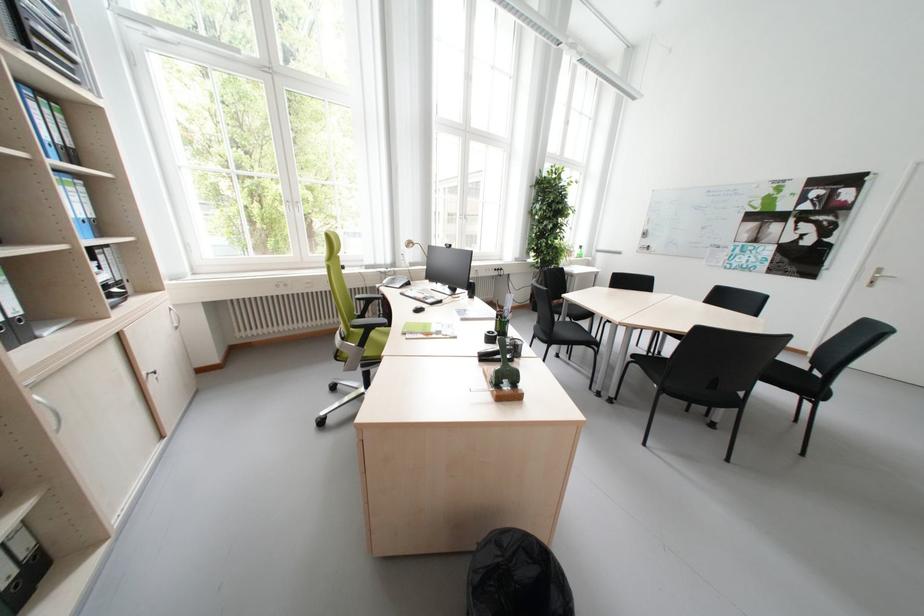
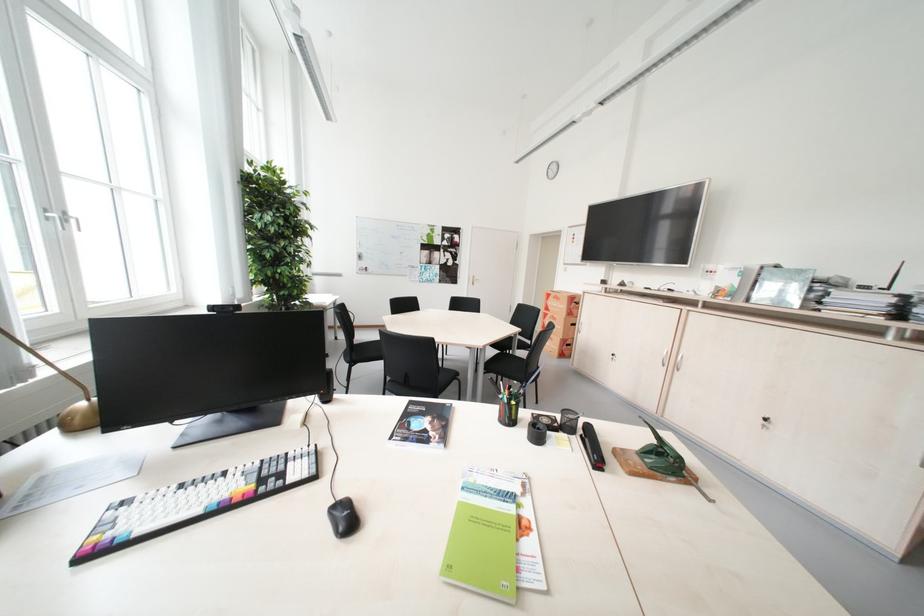
Where in the second image is the point corresponding to the point at 853,264 from the first image?

(473, 275)